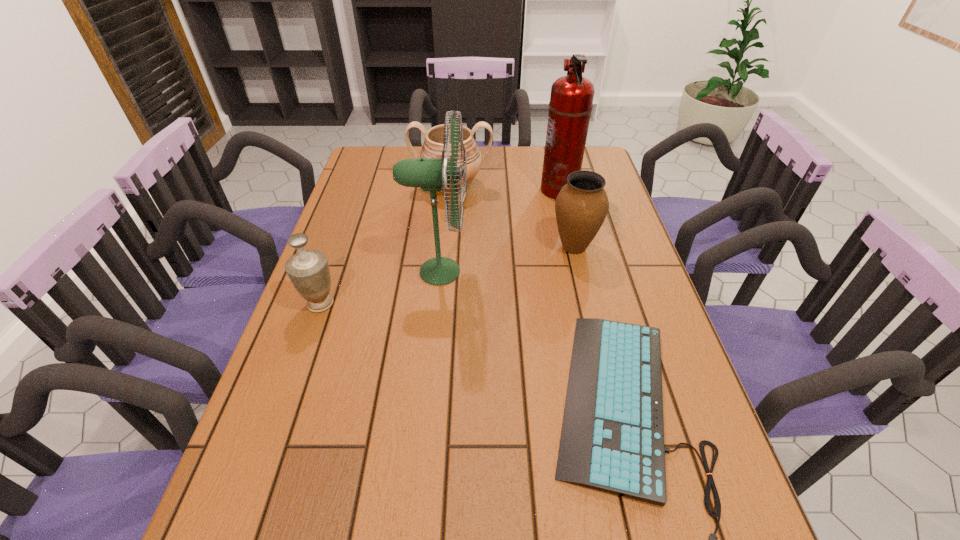
This screenshot has width=960, height=540. I want to click on vacant space located on the front-facing side of the farthest urn, so click(448, 225).

This screenshot has width=960, height=540. Identify the location of vacant space located 0.180m on the left of the rightmost urn. (489, 247).

Locate an element on the screen. free space located on the back of the leftmost object is located at coordinates (354, 208).

Identify the location of fire extinguisher present at the far edge. click(570, 106).

At what (x,y) coordinates should I click in order to perform the action: click on urn located in the far edge section of the desktop. Please return your answer as a coordinate pair (x, y). The width and height of the screenshot is (960, 540). Looking at the image, I should click on (432, 147).

Locate an element on the screen. object situated at the left edge is located at coordinates (308, 270).

At what (x,y) coordinates should I click in order to perform the action: click on fire extinguisher at the right edge. Please return your answer as a coordinate pair (x, y). Looking at the image, I should click on (570, 106).

Find the location of a particular element. The width and height of the screenshot is (960, 540). urn at the right edge is located at coordinates (581, 206).

Identify the location of object that is at the far right corner. This screenshot has height=540, width=960. (570, 106).

This screenshot has height=540, width=960. What are the coordinates of `free point at the far edge` in the screenshot? It's located at (519, 151).